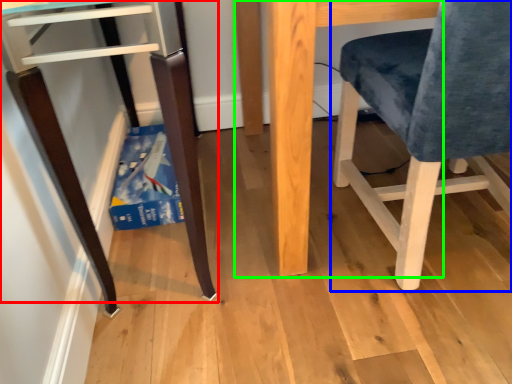
Question: Based on their relative distances, which object is nearer to furniture (highlighted by a red box)? Choose from chair (highlighted by a blue box) and table (highlighted by a green box).

Choices:
 (A) chair
 (B) table

Answer: (B)